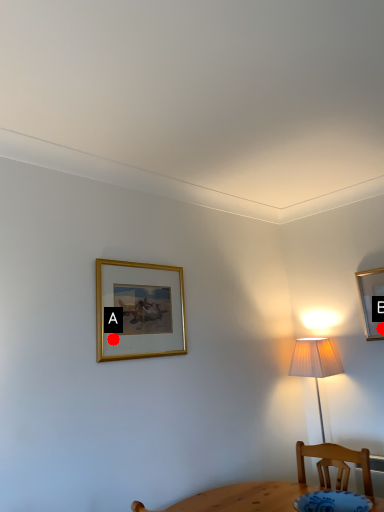
Question: Two points are circled on the image, labeled by A and B beside each circle. Which point is closer to the camera?

Choices:
 (A) A is closer
 (B) B is closer

Answer: (A)